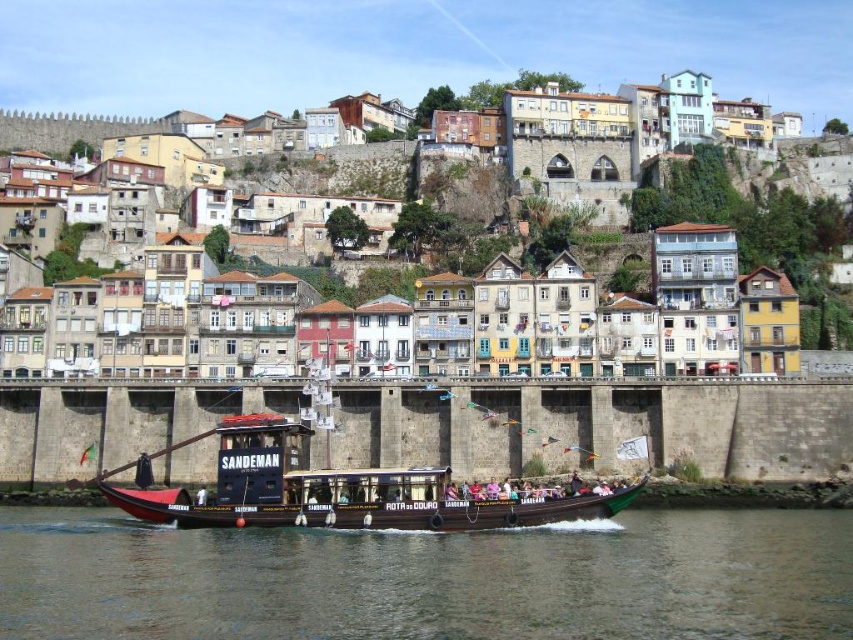
You are standing at the point with coordinates point (22, 609) and want to walk towards the point with coordinates point (637, 214). Given the scene described, what would you encounter first as you move towards your destination?

As you move from point (22, 609) towards point (637, 214), you would first encounter the traditional Portuguese riverboat painted in dark brown with red accents labeled Sandeman and Rota do Douro before reaching the row of colorful houses built on the steep hillside.